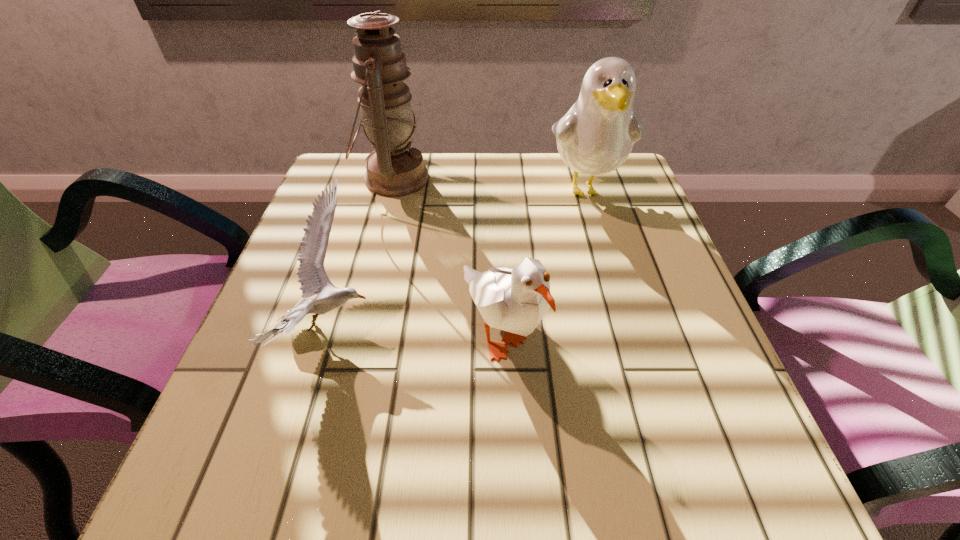
This screenshot has width=960, height=540. I want to click on free region at the left edge, so click(286, 417).

Image resolution: width=960 pixels, height=540 pixels. I want to click on blank space at the right edge of the desktop, so click(655, 253).

In order to click on vacant space at the far left corner of the desktop in this screenshot , I will do `click(365, 166)`.

Locate an element on the screen. vacant space at the far right corner of the desktop is located at coordinates coord(634,173).

Find the location of `vacant space in between the oil lamp and the farthest gull`. vacant space in between the oil lamp and the farthest gull is located at coordinates (490, 184).

Find the location of a particular element. The image size is (960, 540). free spot between the oil lamp and the leftmost gull is located at coordinates (362, 253).

Find the location of `unoccupied area between the second tallest gull and the shortest object`. unoccupied area between the second tallest gull and the shortest object is located at coordinates (416, 329).

I want to click on free space that is in between the tallest gull and the second gull from right to left, so (543, 260).

The width and height of the screenshot is (960, 540). I want to click on empty space between the shortest gull and the third tallest object, so click(x=416, y=329).

Where is `free point between the third tallest object and the oil lamp`? free point between the third tallest object and the oil lamp is located at coordinates (447, 256).